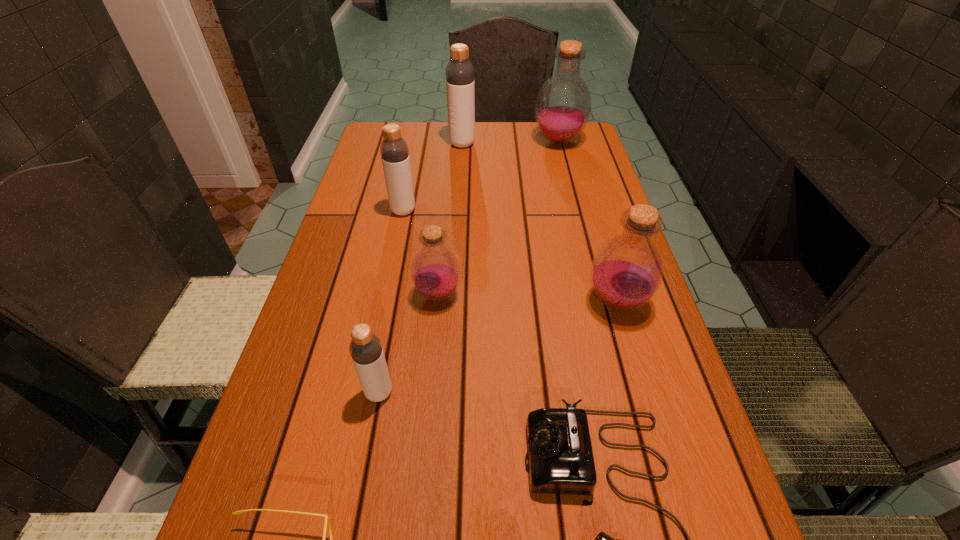
Identify which gray bottle is located as the second nearest to the sixth farthest object. Please provide its 2D coordinates. Your answer should be formatted as a tuple, i.e. [(x, y)], where the tuple contains the x and y coordinates of a point satisfying the conditions above.

[(460, 85)]

Locate which purple bottle ranks second in proximity to the biggest purple bottle. Please provide its 2D coordinates. Your answer should be formatted as a tuple, i.e. [(x, y)], where the tuple contains the x and y coordinates of a point satisfying the conditions above.

[(435, 271)]

Where is `purple bottle that stands as the closest to the smallest purple bottle`? The image size is (960, 540). purple bottle that stands as the closest to the smallest purple bottle is located at coordinates (626, 272).

Locate an element on the screen. free space in the image that satisfies the following two spatial constraints: 1. on the front side of the second biggest purple bottle; 2. on the right side of the farthest purple bottle is located at coordinates (600, 302).

Locate an element on the screen. This screenshot has width=960, height=540. vacant area that satisfies the following two spatial constraints: 1. on the back side of the biggest gray bottle; 2. on the left side of the second farthest gray bottle is located at coordinates (417, 144).

Image resolution: width=960 pixels, height=540 pixels. In order to click on vacant position in the image that satisfies the following two spatial constraints: 1. on the back side of the biggest purple bottle; 2. on the left side of the nearest bottle in this screenshot , I will do `click(424, 141)`.